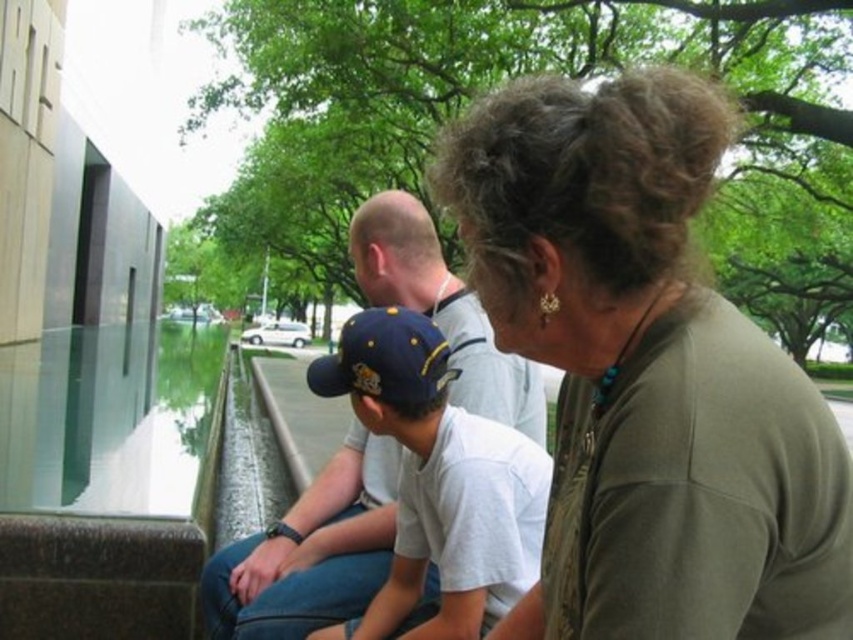
Looking at this image, you are a photographer trying to capture a candid shot of the two subjects in the scene. You notice the matte olive green shirt at center and the matte blue cap at center. Which object should you focus on first if you want to ensure both are in the frame without moving the camera?

The matte olive green shirt at center is positioned over the matte blue cap at center, so focusing on the matte olive green shirt at center first will ensure both are in the frame since it is placed above the other.

You are standing in the plaza and want to place a 30 inch wide bench between the point at coordinates point [660,605] and your current position. Will the bench fit?

The distance between the point at coordinates point [660,605] and the viewer is 36.35 inches. Since the bench is 30 inches wide, it will fit within the available space.

You are a photographer trying to capture a candid shot of the two men sitting at center. You want to ensure both the matte olive green shirt at center and the navy blue fabric baseball cap at center are clearly visible in the frame. Based on their positions, which object should you focus on first to ensure both are in focus?

The matte olive green shirt at center is in front of the navy blue fabric baseball cap at center. To ensure both are in focus, you should focus on the matte olive green shirt at center first since it is closer to the camera, allowing the background object to remain in acceptable focus range.